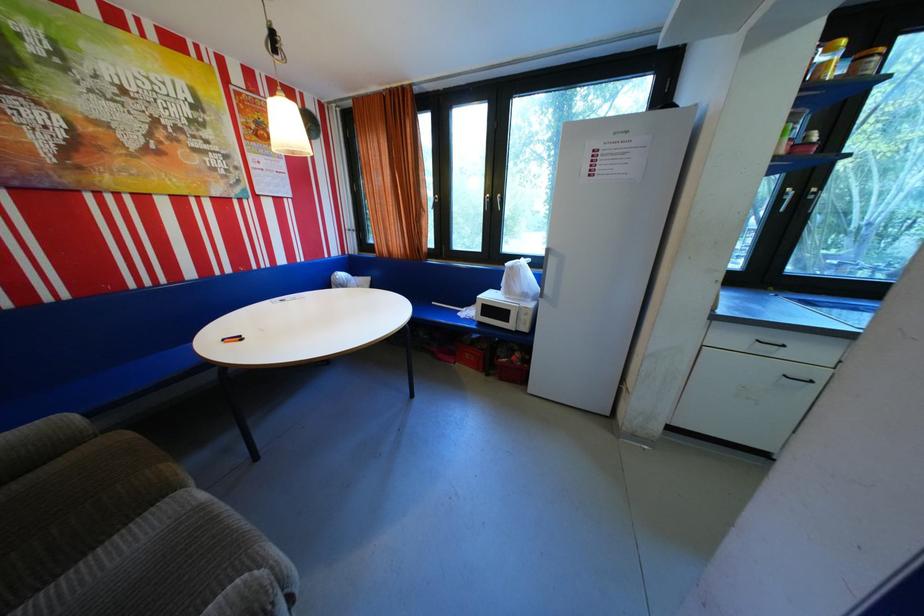
The location [827,60] corresponds to which object?

It corresponds to the yellow-capped jar in the image.